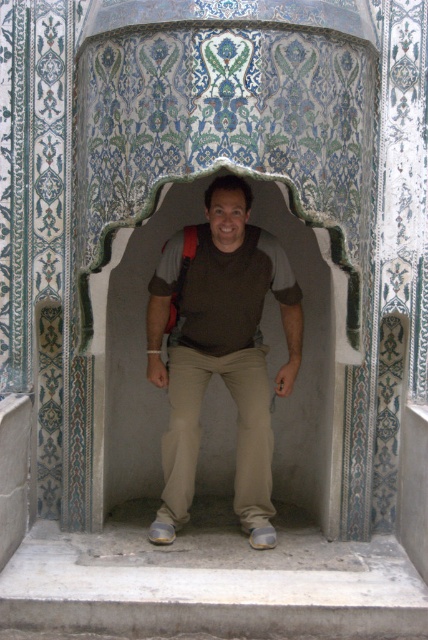
Does gray concrete stairs at lower center have a greater width compared to brown matte shirt at center?

Correct, the width of gray concrete stairs at lower center exceeds that of brown matte shirt at center.

Does gray concrete stairs at lower center lie in front of brown matte shirt at center?

Yes, it is.

Is point (261, 593) positioned before point (199, 324)?

Yes, point (261, 593) is in front of point (199, 324).

Locate an element on the screen. This screenshot has height=640, width=428. gray concrete stairs at lower center is located at coordinates (211, 582).